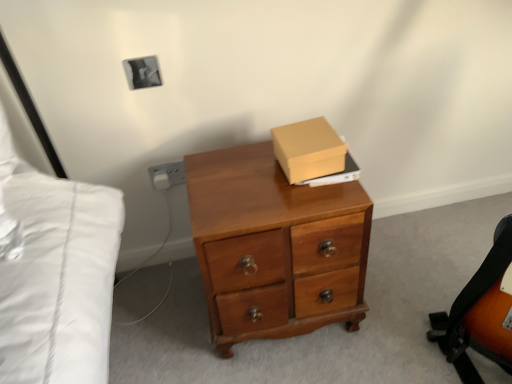
This screenshot has width=512, height=384. Identify the location of vacant region to the left of matte cardboard box at upper center. (238, 180).